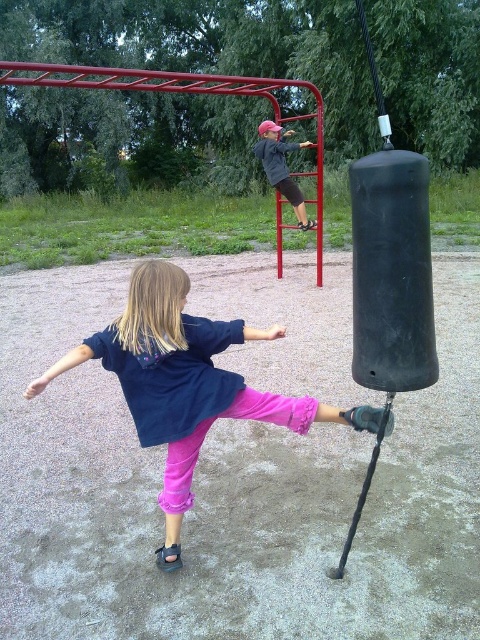
Question: Which of the following is the closest to the observer?

Choices:
 (A) (322, 417)
 (B) (291, 196)

Answer: (A)

Question: Does pink fabric pants at lower center have a greater width compared to matte black jacket at upper center?

Choices:
 (A) yes
 (B) no

Answer: (A)

Question: Is pink fabric pants at lower center positioned at the back of matte black jacket at upper center?

Choices:
 (A) no
 (B) yes

Answer: (A)

Question: Is pink fabric pants at lower center below matte black jacket at upper center?

Choices:
 (A) no
 (B) yes

Answer: (B)

Question: Among these points, which one is nearest to the camera?

Choices:
 (A) (144, 417)
 (B) (254, 150)

Answer: (A)